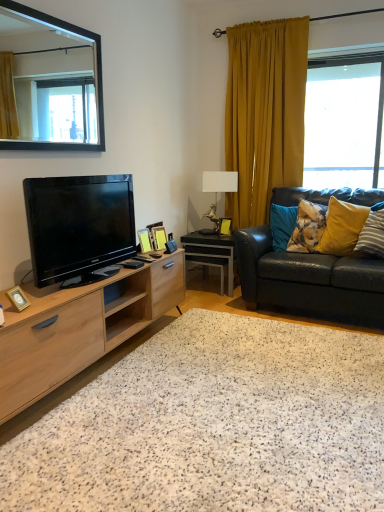
I want to click on vacant area in front of gold metallic photo frame at lower left, acting as the 1th picture frame starting from the front, so (x=17, y=315).